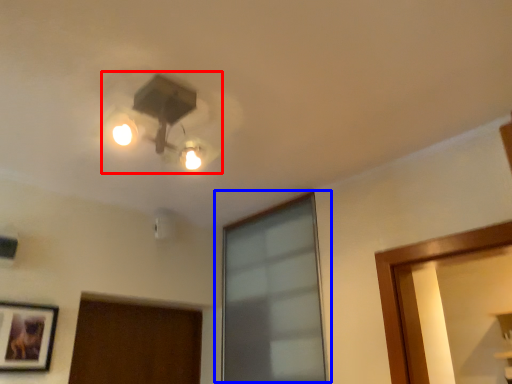
Question: Which of the following is the farthest to the observer, lamp (highlighted by a red box) or window (highlighted by a blue box)?

Choices:
 (A) lamp
 (B) window

Answer: (B)